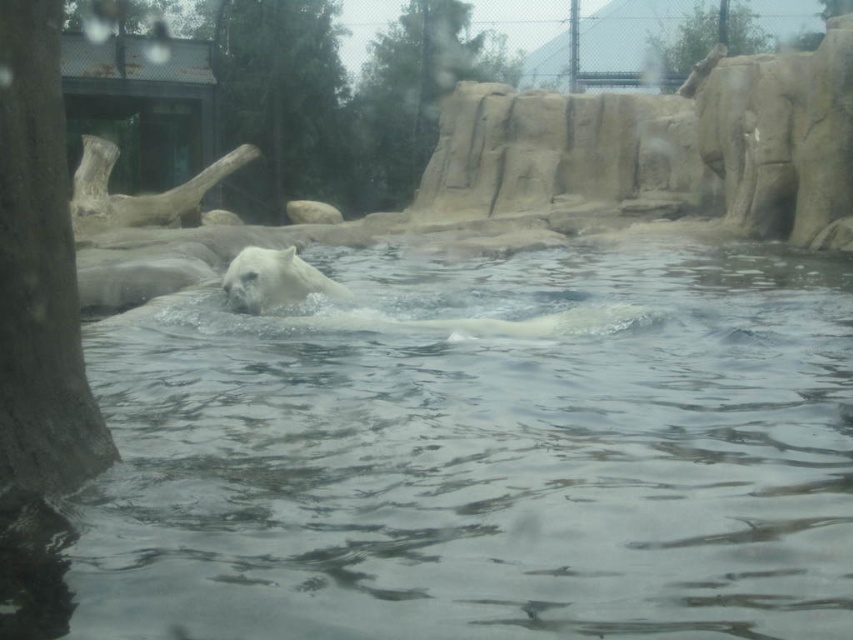
Question: Does smooth bark tree at left lie behind white fur bear at center?

Choices:
 (A) no
 (B) yes

Answer: (A)

Question: Can you confirm if smooth bark tree at left is thinner than green textured tree at upper left?

Choices:
 (A) yes
 (B) no

Answer: (A)

Question: Which object appears closest to the camera in this image?

Choices:
 (A) smooth bark tree at left
 (B) green textured rock at upper center

Answer: (A)

Question: Is green textured rock at upper center thinner than white fur bear at center?

Choices:
 (A) yes
 (B) no

Answer: (B)

Question: Among these objects, which one is farthest from the camera?

Choices:
 (A) green textured tree at upper left
 (B) smooth bark tree at left

Answer: (A)

Question: Which object is the closest to the green textured tree at upper left?

Choices:
 (A) smooth bark tree at left
 (B) green leafy tree at upper center
 (C) white fur bear at center
 (D) green textured rock at upper center

Answer: (D)